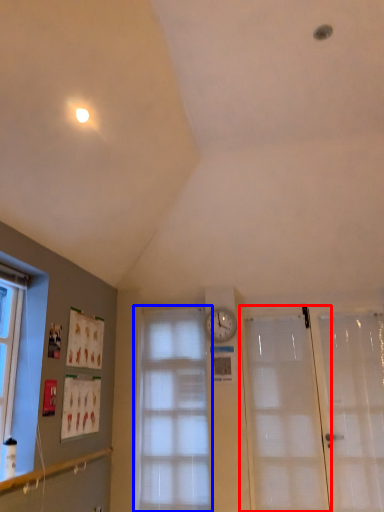
Question: Which of the following is the closest to the observer, door (highlighted by a red box) or window (highlighted by a blue box)?

Choices:
 (A) door
 (B) window

Answer: (A)